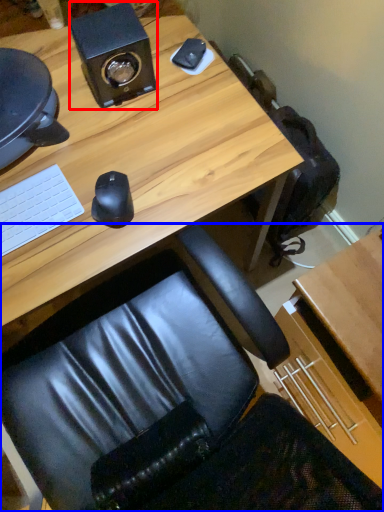
Question: Which of the following is the farthest to the observer, speaker (highlighted by a red box) or chair (highlighted by a blue box)?

Choices:
 (A) speaker
 (B) chair

Answer: (A)